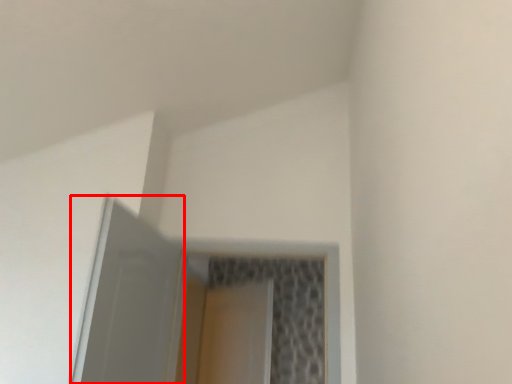
Question: Considering the relative positions of screen door (annotated by the red box) and screen door in the image provided, where is screen door (annotated by the red box) located with respect to the staircase?

Choices:
 (A) left
 (B) right

Answer: (A)